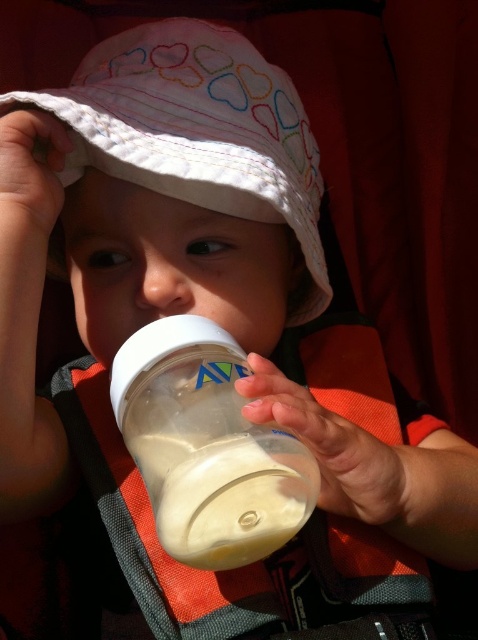
Question: Which of the following is the farthest from the observer?

Choices:
 (A) (150, 488)
 (B) (250, 86)

Answer: (B)

Question: Is white cotton hat at upper center below transparent plastic bottle at center?

Choices:
 (A) no
 (B) yes

Answer: (A)

Question: Can you confirm if white cotton hat at upper center is positioned above transparent plastic bottle at center?

Choices:
 (A) yes
 (B) no

Answer: (A)

Question: Can you confirm if white cotton hat at upper center is smaller than transparent plastic bottle at center?

Choices:
 (A) yes
 (B) no

Answer: (B)

Question: Which object is closer to the camera taking this photo?

Choices:
 (A) transparent plastic bottle at center
 (B) white cotton hat at upper center

Answer: (A)